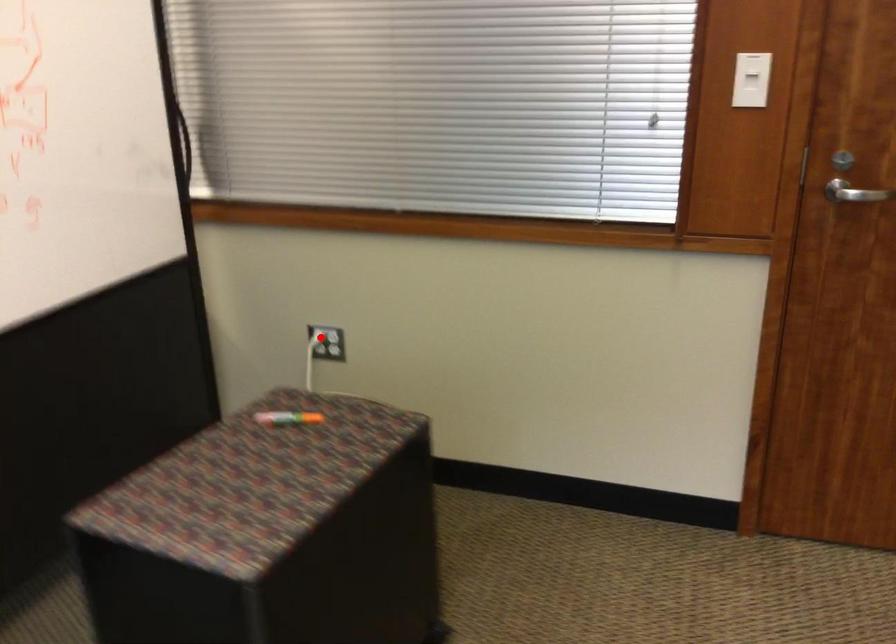
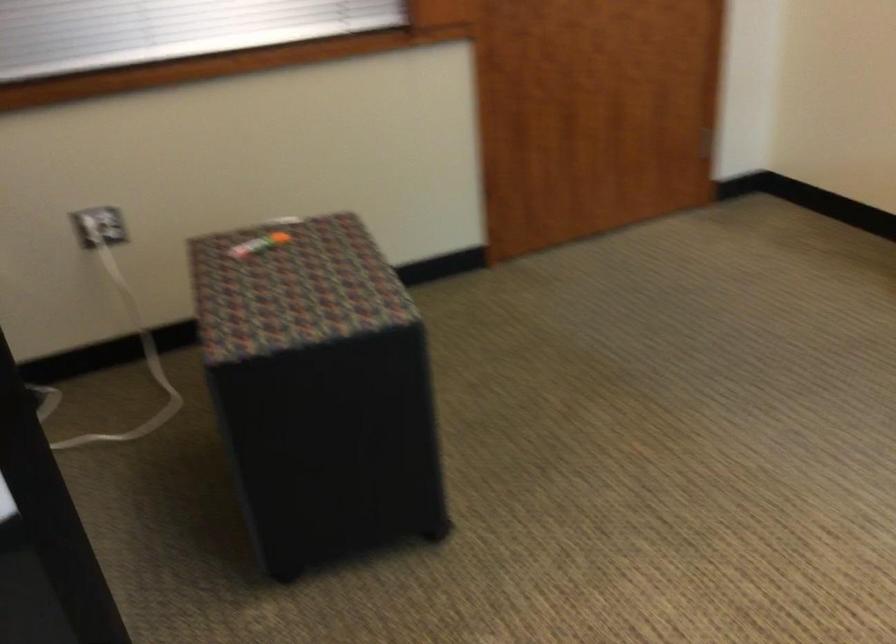
Where in the second image is the point corresponding to the highlighted location from the first image?

(92, 231)